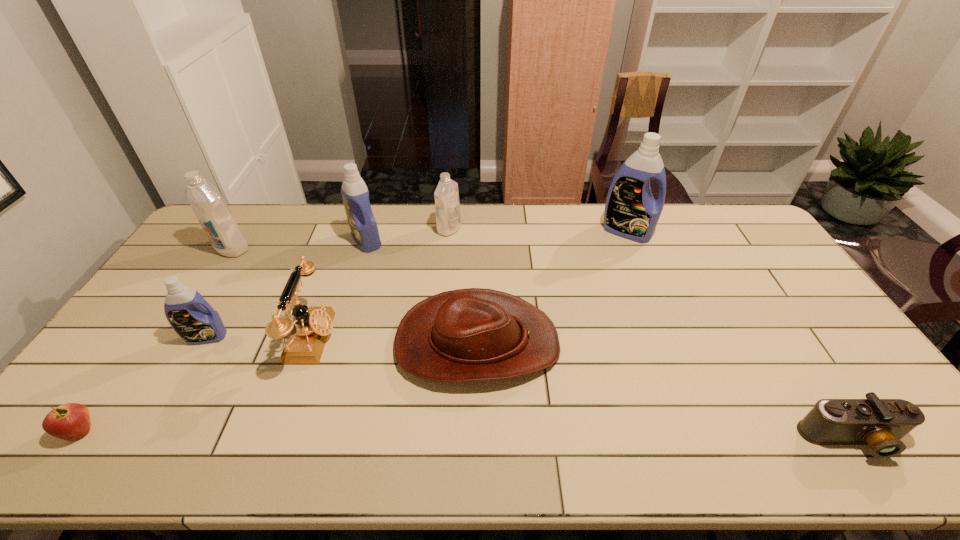
At what (x,y) coordinates should I click in order to perform the action: click on cowboy hat. Please return your answer as a coordinate pair (x, y). Looking at the image, I should click on (475, 334).

I want to click on apple, so click(x=70, y=421).

I want to click on the rightmost object, so click(880, 423).

Locate an element on the screen. free region located 0.180m on the left of the tallest detergent is located at coordinates click(552, 231).

At what (x,y) coordinates should I click in order to perform the action: click on free spot located on the right of the left white detergent. Please return your answer as a coordinate pair (x, y). Looking at the image, I should click on (348, 248).

Locate an element on the screen. This screenshot has width=960, height=540. vacant space situated on the right of the second blue detergent from right to left is located at coordinates (467, 241).

Identify the location of vacant space located 0.330m on the front of the second detergent from right to left. This screenshot has height=540, width=960. (444, 304).

You are a GUI agent. You are given a task and a screenshot of the screen. Output one action in this format:
    pyautogui.click(x=<x>, y=<y>)
    Task: Click on the blank area located on the right of the nearest blue detergent
    This screenshot has width=960, height=540.
    Given the screenshot: What is the action you would take?
    tap(276, 337)

Locate an element on the screen. This screenshot has width=960, height=540. blank space located on the dial of the beige telephone is located at coordinates (468, 339).

Identify the location of vacant space located 0.290m on the front-facing side of the cowboy hat. (662, 343).